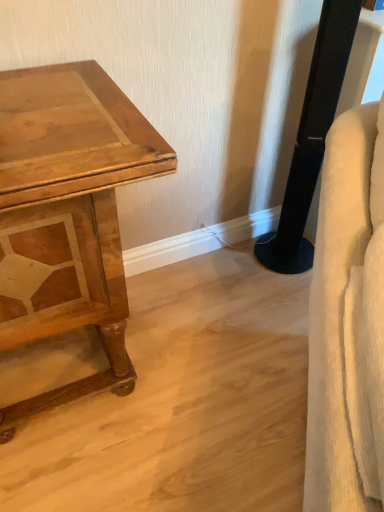
Locate an element on the screen. The width and height of the screenshot is (384, 512). vacant space in between wooden table at left and black plastic speaker at right is located at coordinates (207, 300).